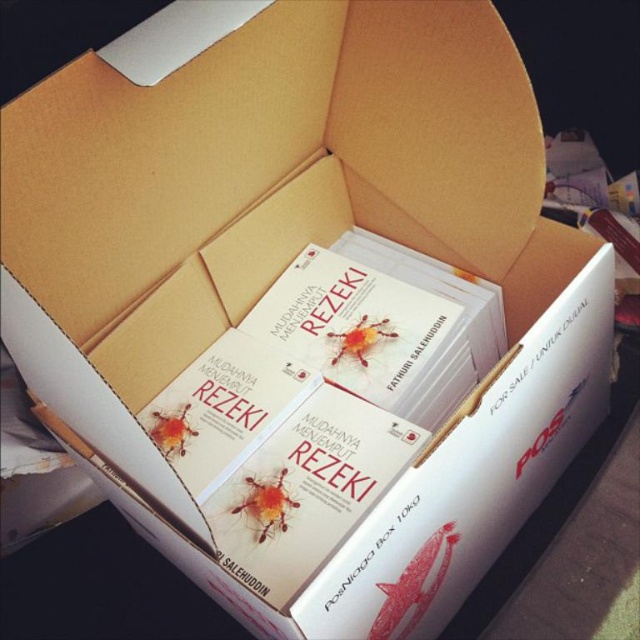
Question: Is white matte book at center to the left of matte white book at center from the viewer's perspective?

Choices:
 (A) no
 (B) yes

Answer: (B)

Question: Which object is farther from the camera taking this photo?

Choices:
 (A) matte white book at center
 (B) white matte book at center

Answer: (A)

Question: Is white matte book at center to the right of matte white book at center from the viewer's perspective?

Choices:
 (A) no
 (B) yes

Answer: (A)

Question: Considering the relative positions of white matte book at center and matte white book at center in the image provided, where is white matte book at center located with respect to matte white book at center?

Choices:
 (A) left
 (B) right

Answer: (A)